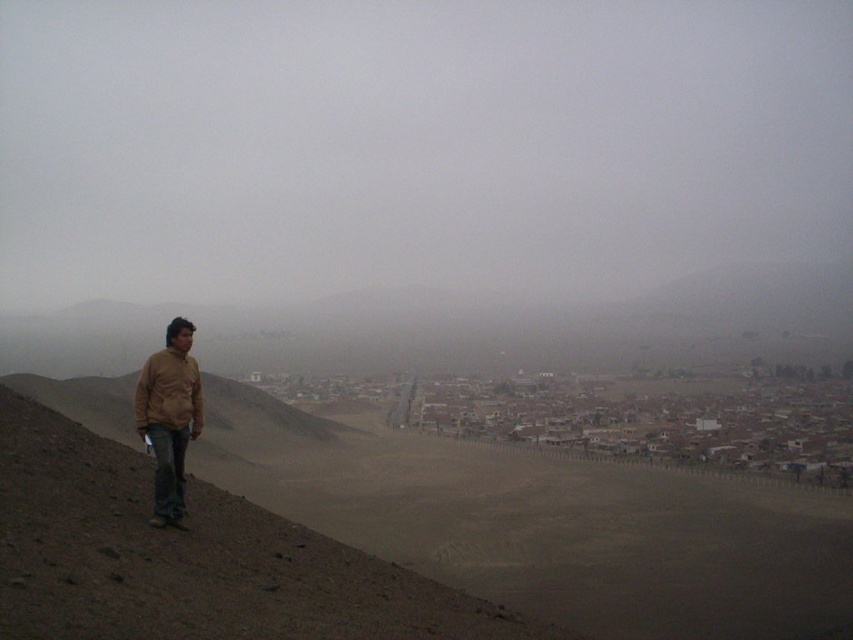
Which is more to the right, gray fog at upper center or dull brown dirt at left?

dull brown dirt at left is more to the right.

Does gray fog at upper center lie behind dull brown dirt at left?

Yes, gray fog at upper center is behind dull brown dirt at left.

Does point (221, 289) come closer to viewer compared to point (285, 627)?

No.

Where is `gray fog at upper center`? gray fog at upper center is located at coordinates (415, 145).

Find the location of a particular element. dull brown dirt at left is located at coordinates [189, 557].

Who is more distant from viewer, (427, 627) or (187, 435)?

The point (187, 435) is more distant.

Where is `dull brown dirt at left`? The height and width of the screenshot is (640, 853). dull brown dirt at left is located at coordinates (189, 557).

Which is below, matte brown jacket at left or brown matte jacket at lower left?

Positioned lower is matte brown jacket at left.

Can you confirm if matte brown jacket at left is wider than brown matte jacket at lower left?

No, matte brown jacket at left is not wider than brown matte jacket at lower left.

Describe the element at coordinates (169, 417) in the screenshot. The width and height of the screenshot is (853, 640). I see `matte brown jacket at left` at that location.

I want to click on matte brown jacket at left, so click(x=169, y=417).